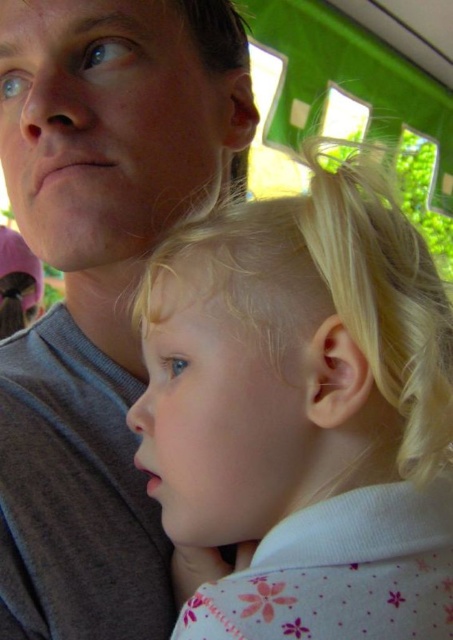
Is the position of blonde hair at center less distant than that of gray cotton shirt at upper left?

Yes, blonde hair at center is closer to the viewer.

Can you confirm if blonde hair at center is bigger than gray cotton shirt at upper left?

Incorrect, blonde hair at center is not larger than gray cotton shirt at upper left.

Is point (351, 282) positioned behind point (14, 392)?

No, it is not.

The image size is (453, 640). What are the coordinates of `blonde hair at center` in the screenshot? It's located at (302, 416).